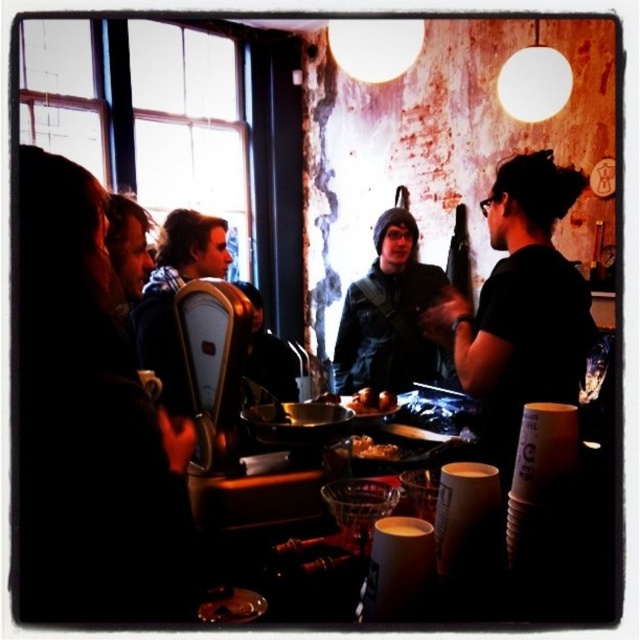
Question: Which object appears closest to the camera in this image?

Choices:
 (A) denim jacket at center
 (B) golden crispy fries at center

Answer: (B)

Question: From the image, what is the correct spatial relationship of black matte shirt at center in relation to denim jacket at center?

Choices:
 (A) left
 (B) right

Answer: (B)

Question: Is denim jacket at center below golden crispy fries at center?

Choices:
 (A) yes
 (B) no

Answer: (B)

Question: Which point is farther to the camera?

Choices:
 (A) (380, 403)
 (B) (387, 289)

Answer: (B)

Question: Which of the following is the farthest from the observer?

Choices:
 (A) (362, 404)
 (B) (387, 444)
 (C) (404, 240)
 (D) (552, 289)

Answer: (C)

Question: Is black matte shirt at center wider than denim jacket at center?

Choices:
 (A) yes
 (B) no

Answer: (B)